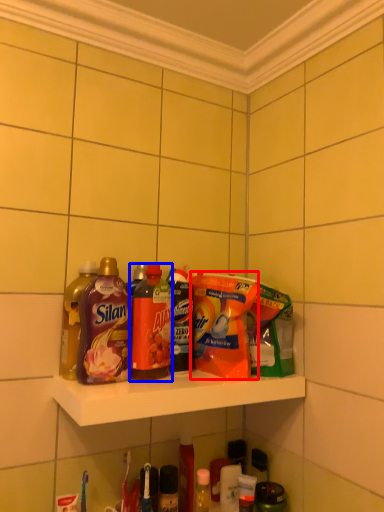
Question: Which of the following is the farthest to the observer, cleaning product (highlighted by a red box) or bottle (highlighted by a blue box)?

Choices:
 (A) cleaning product
 (B) bottle

Answer: (A)